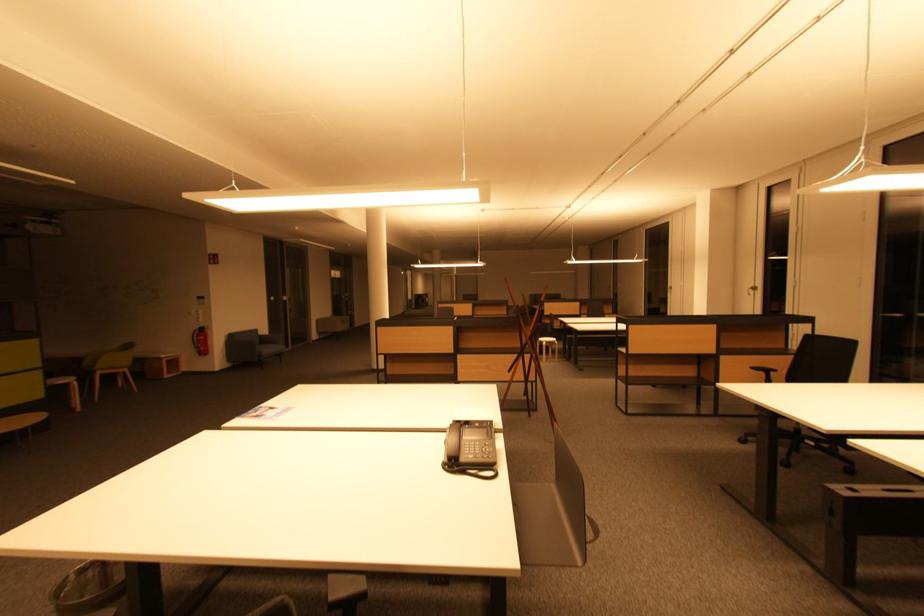
The width and height of the screenshot is (924, 616). Find the location of `fire extinguisher handle`. fire extinguisher handle is located at coordinates (200, 339).